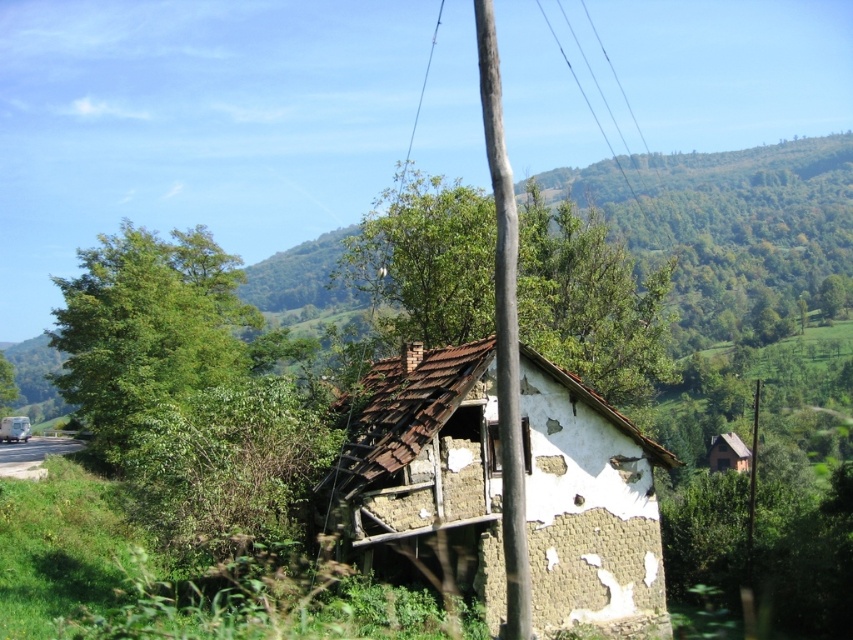
You are a bird looking for a place to perch. You see the green leafy tree at left and the brown wooden telegraph pole at center. Which one is closer to the left side of the image?

The green leafy tree at left is closer to the left side of the image than the brown wooden telegraph pole at center.

You are standing in front of the old house and notice two points marked on the image. The first point is at coordinates point (518, 387) and the second is at point (733, 467). Which point is closer to you?

Point (518, 387) is closer to the viewer than point (733, 467).

You are a painter planning to capture the abandoned house in the image. You want to ensure the green leafy tree at left and the brown wooden telegraph pole at center are both visible in your painting. Considering their sizes, which object should you place closer to the center of the canvas to maintain balance?

The green leafy tree at left is bigger than the brown wooden telegraph pole at center. To balance their sizes in the painting, place the smaller brown wooden telegraph pole at center closer to the center of the canvas while positioning the larger green leafy tree at left slightly off to the side.